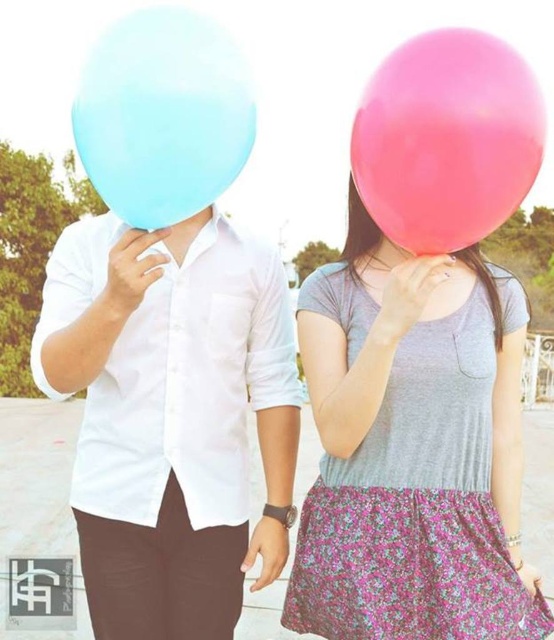
You are planning to take a photo of the two balloons in the scene. The matte pink balloon at center and the pink rubber balloon at upper right. Which balloon is wider?

The matte pink balloon at center is wider than the pink rubber balloon at upper right.

You are a photographer trying to capture a clear shot of the white matte shirt at left and the matte blue balloon at upper left. Since the background is very bright, you want to adjust your camera settings to focus on the darker objects. Which object should you prioritize focusing on to ensure it isn t washed out by the sunlight?

The white matte shirt at left is bigger than the matte blue balloon at upper left, so it would likely be more dominant in the frame and require proper exposure to avoid being washed out. Prioritize focusing on the white matte shirt at left.